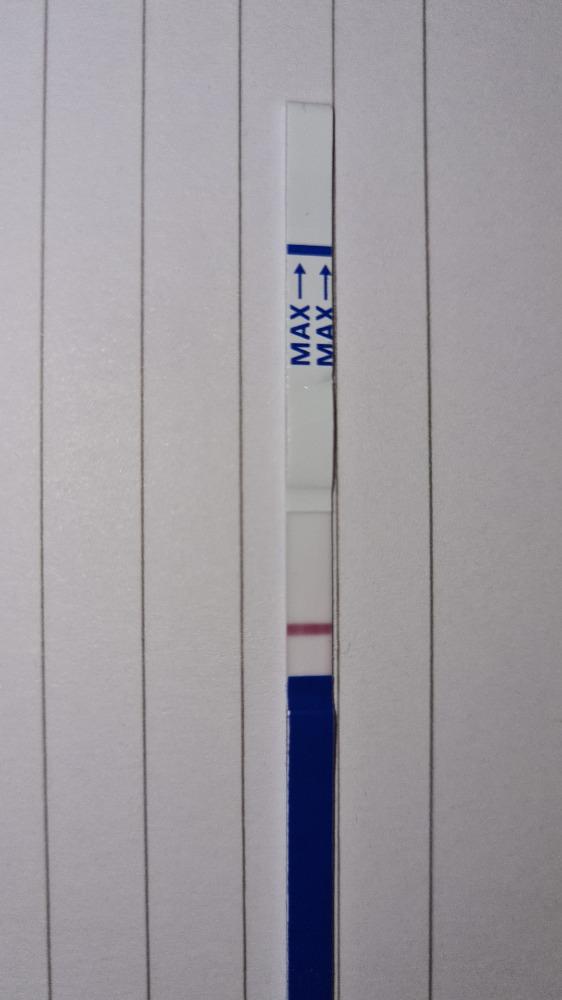
The width and height of the screenshot is (562, 1000). Find the location of `corners of section colored blue`. corners of section colored blue is located at coordinates (288, 680), (330, 679), (288, 994), (334, 997).